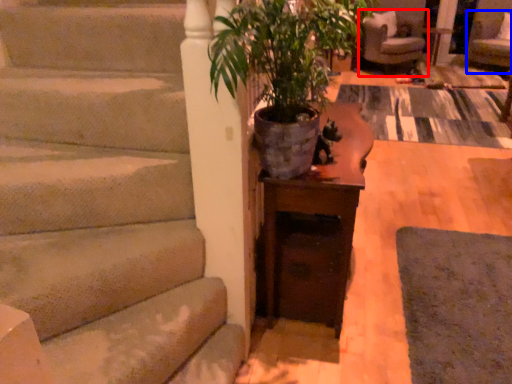
Question: Which point is closer to the camera, chair (highlighted by a red box) or armchair (highlighted by a blue box)?

Choices:
 (A) chair
 (B) armchair

Answer: (B)